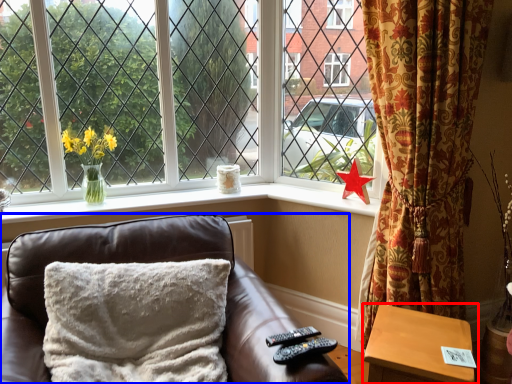
Question: Which point is further to the camera, table (highlighted by a red box) or furniture (highlighted by a blue box)?

Choices:
 (A) table
 (B) furniture

Answer: (A)